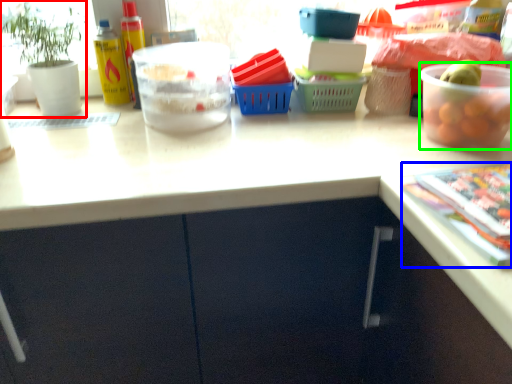
Question: Which object is the closest to the houseplant (highlighted by a red box)? Choose among these: magazine (highlighted by a blue box) or bowl (highlighted by a green box).

Choices:
 (A) magazine
 (B) bowl

Answer: (B)